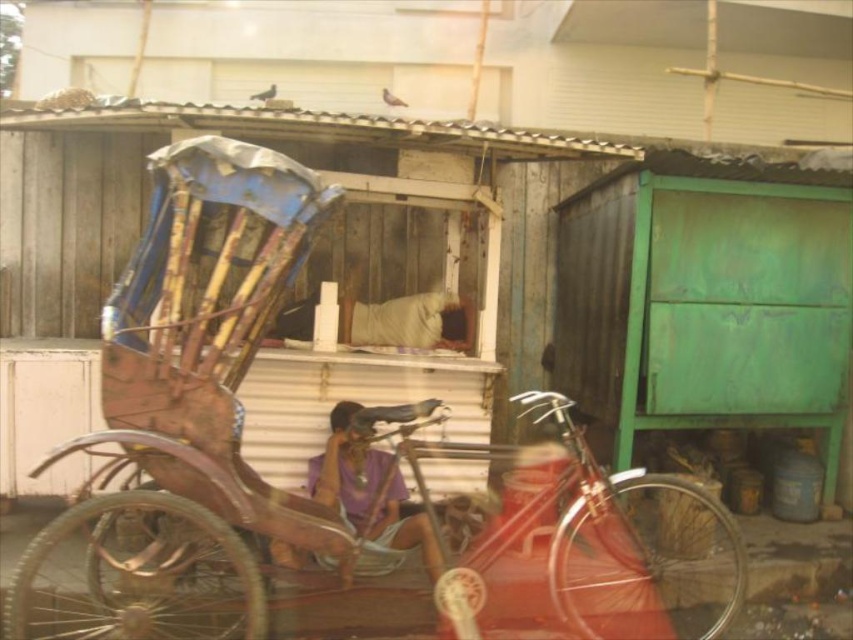
Question: Does rusty wood rickshaw at center come behind purple fabric at center?

Choices:
 (A) no
 (B) yes

Answer: (A)

Question: Which of the following is the closest to the observer?

Choices:
 (A) purple fabric at center
 (B) rusty wood rickshaw at center

Answer: (B)

Question: Does rusty wood rickshaw at center appear on the left side of purple fabric at center?

Choices:
 (A) no
 (B) yes

Answer: (A)

Question: Which of the following is the farthest from the observer?

Choices:
 (A) (241, 492)
 (B) (339, 499)

Answer: (B)

Question: In this image, where is rusty wood rickshaw at center located relative to purple fabric at center?

Choices:
 (A) above
 (B) below

Answer: (B)

Question: Among these points, which one is farthest from the camera?

Choices:
 (A) (350, 522)
 (B) (218, 198)

Answer: (A)